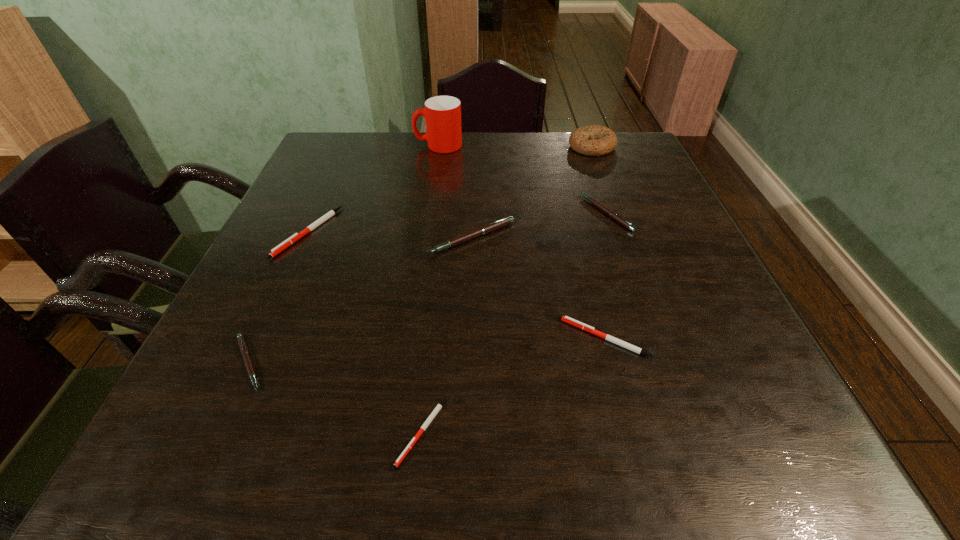
Identify which object is the nearest to the biggest white pen. Please provide its 2D coordinates. Your answer should be formatted as a tuple, i.e. [(x, y)], where the tuple contains the x and y coordinates of a point satisfying the conditions above.

[(244, 351)]

Locate an element on the screen. This screenshot has height=540, width=960. object that is the closest to the rightmost pink pen is located at coordinates (500, 223).

This screenshot has width=960, height=540. I want to click on pen that is the fifth closest to the second smallest white pen, so click(x=275, y=251).

Identify which pen is located as the sixth nearest to the cup. Please provide its 2D coordinates. Your answer should be formatted as a tuple, i.e. [(x, y)], where the tuple contains the x and y coordinates of a point satisfying the conditions above.

[(439, 406)]

Identify which pink pen is the third nearest to the second smallest white pen. Please provide its 2D coordinates. Your answer should be formatted as a tuple, i.e. [(x, y)], where the tuple contains the x and y coordinates of a point satisfying the conditions above.

[(244, 351)]

Select which pink pen is the closest to the biggest pink pen. Please provide its 2D coordinates. Your answer should be formatted as a tuple, i.e. [(x, y)], where the tuple contains the x and y coordinates of a point satisfying the conditions above.

[(612, 214)]

Locate an element on the screen. The height and width of the screenshot is (540, 960). white pen that stands as the second closest to the shortest object is located at coordinates (275, 251).

Identify the location of white pen that is the closest one to the shortest pen. Image resolution: width=960 pixels, height=540 pixels. (590, 329).

Where is `free region that satisfies the following two spatial constraints: 1. at the nib of the biggest pink pen; 2. at the nib of the smallest pink pen`? free region that satisfies the following two spatial constraints: 1. at the nib of the biggest pink pen; 2. at the nib of the smallest pink pen is located at coordinates (469, 363).

Find the location of a particular element. free space that satisfies the following two spatial constraints: 1. at the nib of the second smallest pink pen; 2. at the nib of the biggest pink pen is located at coordinates (615, 238).